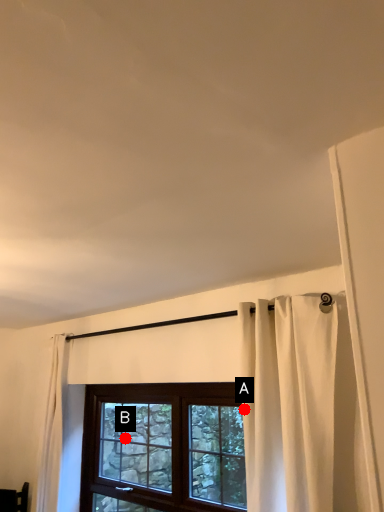
Question: Two points are circled on the image, labeled by A and B beside each circle. Which point is closer to the camera?

Choices:
 (A) A is closer
 (B) B is closer

Answer: (A)